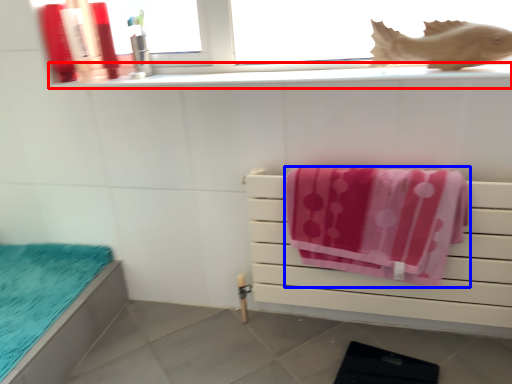
Question: Which object appears closest to the camera in this image, window sill (highlighted by a red box) or towel (highlighted by a blue box)?

Choices:
 (A) window sill
 (B) towel

Answer: (B)